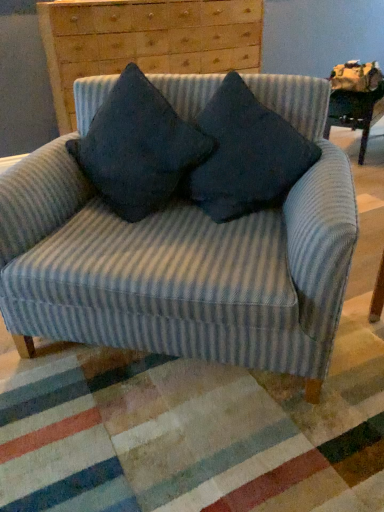
Question: Which direction should I rotate to look at dark blue fabric pillow at center, which is the 1th pillow in right-to-left order?

Choices:
 (A) right
 (B) left

Answer: (A)

Question: Can you see dark blue fabric pillow at center, which is counted as the first pillow, starting from the left, touching wooden chest of drawers at upper center?

Choices:
 (A) yes
 (B) no

Answer: (B)

Question: Does dark blue fabric pillow at center, which is counted as the first pillow, starting from the left, have a larger size compared to wooden chest of drawers at upper center?

Choices:
 (A) no
 (B) yes

Answer: (A)

Question: Is dark blue fabric pillow at center, the 2th pillow viewed from the right, located outside wooden chest of drawers at upper center?

Choices:
 (A) yes
 (B) no

Answer: (A)

Question: Does dark blue fabric pillow at center, which is counted as the first pillow, starting from the left, appear on the left side of wooden chest of drawers at upper center?

Choices:
 (A) no
 (B) yes

Answer: (A)

Question: Is dark blue fabric pillow at center, the 2th pillow viewed from the right, not close to wooden chest of drawers at upper center?

Choices:
 (A) yes
 (B) no

Answer: (A)

Question: From a real-world perspective, is dark blue fabric pillow at center, the 2th pillow viewed from the right, located beneath wooden chest of drawers at upper center?

Choices:
 (A) no
 (B) yes

Answer: (B)

Question: Is dark blue fabric pillow at center, which is counted as the first pillow, starting from the left, facing away from blue striped fabric chair at center?

Choices:
 (A) no
 (B) yes

Answer: (B)

Question: Is dark blue fabric pillow at center, which is counted as the first pillow, starting from the left, far away from blue striped fabric chair at center?

Choices:
 (A) yes
 (B) no

Answer: (B)

Question: Does dark blue fabric pillow at center, the 2th pillow viewed from the right, have a smaller size compared to blue striped fabric chair at center?

Choices:
 (A) yes
 (B) no

Answer: (A)

Question: Can you confirm if dark blue fabric pillow at center, the 2th pillow viewed from the right, is positioned to the right of blue striped fabric chair at center?

Choices:
 (A) yes
 (B) no

Answer: (B)

Question: From the image's perspective, would you say dark blue fabric pillow at center, which is counted as the first pillow, starting from the left, is positioned over blue striped fabric chair at center?

Choices:
 (A) yes
 (B) no

Answer: (A)

Question: Can blue striped fabric chair at center be found inside dark blue fabric pillow at center, which is counted as the first pillow, starting from the left?

Choices:
 (A) no
 (B) yes

Answer: (A)

Question: Does blue striped fabric chair at center have a greater height compared to dark blue fabric pillow at center, which is the 1th pillow in right-to-left order?

Choices:
 (A) yes
 (B) no

Answer: (A)